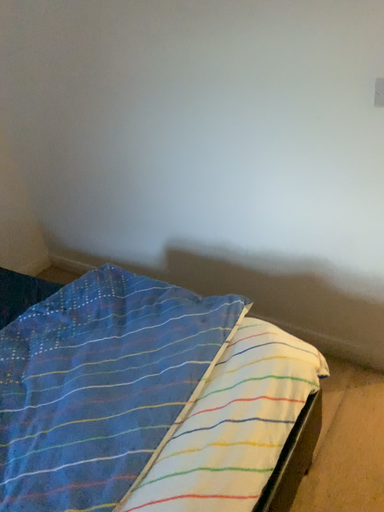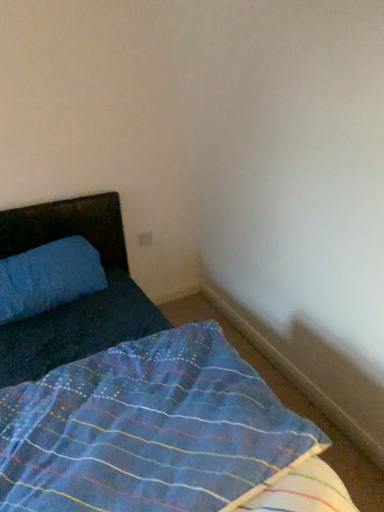
Question: How did the camera likely rotate when shooting the video?

Choices:
 (A) rotated downward
 (B) rotated upward

Answer: (B)